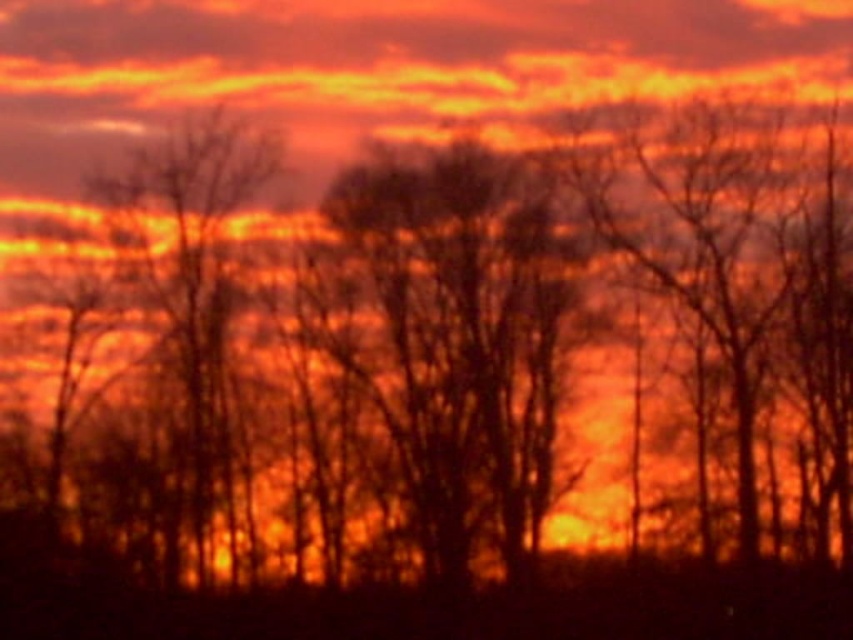
Who is taller, silhouette tree at center or matte orange cloud at upper center?

silhouette tree at center is taller.

Is silhouette tree at center below matte orange cloud at upper center?

Indeed, silhouette tree at center is positioned under matte orange cloud at upper center.

Describe the element at coordinates (463, 340) in the screenshot. I see `silhouette tree at center` at that location.

Identify the location of silhouette tree at center. (463, 340).